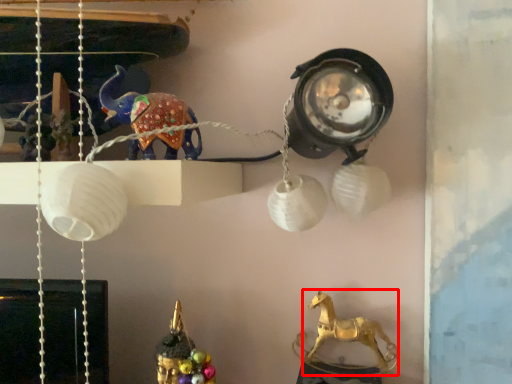
Question: Where is animal (annotated by the red box) located in relation to animal in the image?

Choices:
 (A) left
 (B) right

Answer: (B)